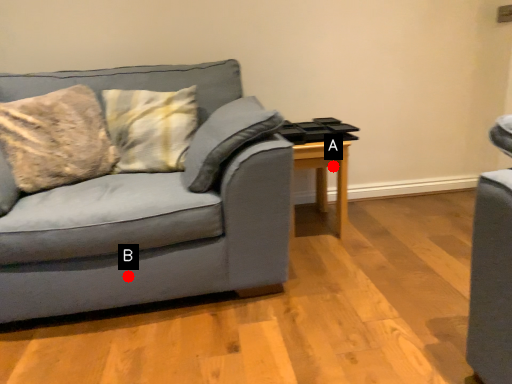
Question: Two points are circled on the image, labeled by A and B beside each circle. Which point is closer to the camera?

Choices:
 (A) A is closer
 (B) B is closer

Answer: (B)